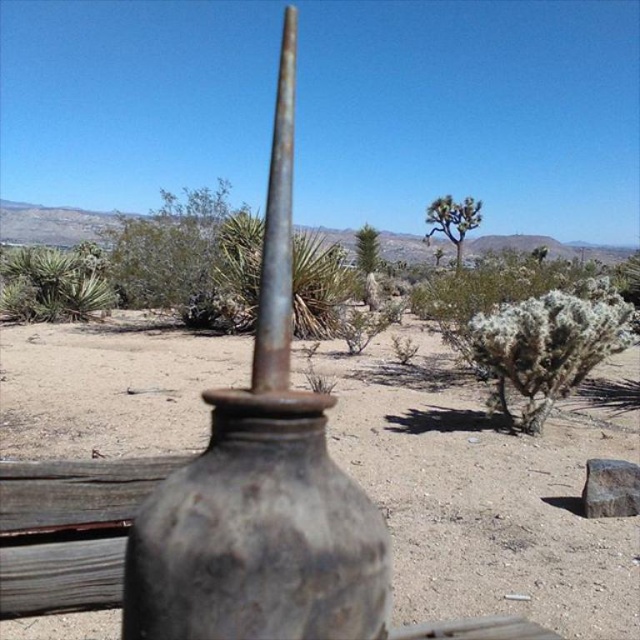
You are an archaeologist examining the scene. You notice the rusty metallic dirt field at center and the rusty metal vase at center. Which object takes up more space in the image?

The rusty metallic dirt field at center has a larger size compared to the rusty metal vase at center, so it takes up more space in the image.

You are a botanist studying desert plants. You notice the rusty metal vase at center and the green leafy tree at center in the image. Which object has a narrower width?

The rusty metal vase at center is thinner than the green leafy tree at center, so the rusty metal vase at center has a narrower width.

You are standing at the center of the desert scene. There is a point marked at coordinates (134, 243). What object is located at that point?

The point at (134, 243) has a green shrub at center.